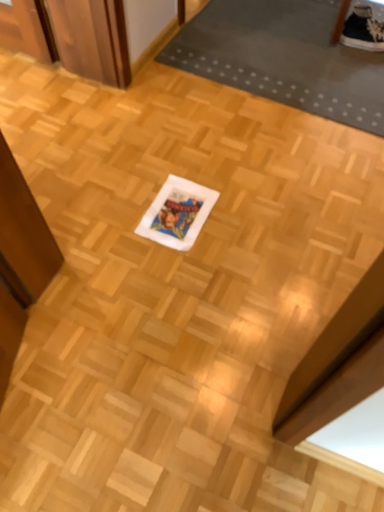
Where is `free spot in front of dark gray rubber mat at upper right`? The height and width of the screenshot is (512, 384). free spot in front of dark gray rubber mat at upper right is located at coordinates (241, 151).